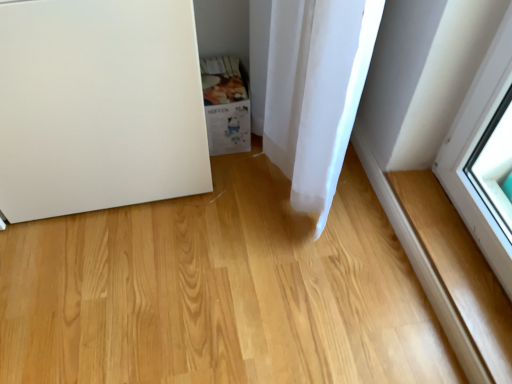
What do you see at coordinates (225, 105) in the screenshot? The width and height of the screenshot is (512, 384). I see `white paperboard box at center` at bounding box center [225, 105].

What is the approximate width of white paperboard box at center?

It is 10.52 inches.

Locate an element on the screen. Image resolution: width=512 pixels, height=384 pixels. white paperboard box at center is located at coordinates (225, 105).

What is the approximate height of white paperboard box at center?

The height of white paperboard box at center is 9.37 inches.

Find the location of a particular element. white paperboard box at center is located at coordinates (225, 105).